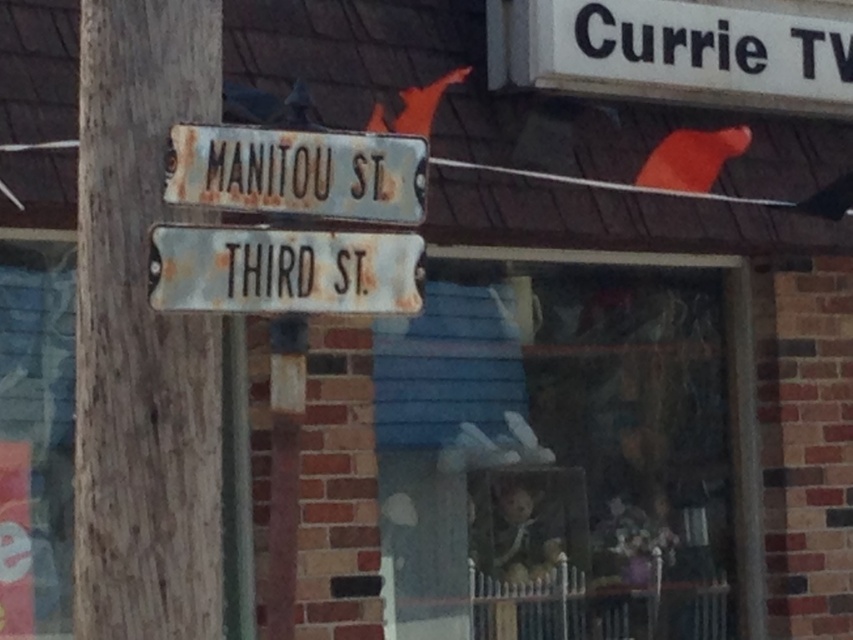
You are a painter who needs to paint both the rusty wood telegraph pole at left and the rusty metal street sign at center. Which object will require more ladder height to reach its top?

The rusty wood telegraph pole at left is much taller as rusty metal street sign at center, so the painter will need a taller ladder to reach the top of the rusty wood telegraph pole at left.

You are standing in front of a street signpost and want to take a photo of both the blue wooden fence at center and the rusty metal pole at left. Which object should you focus on first if you want to include both in your frame without moving the camera?

The blue wooden fence at center is larger in size than the rusty metal pole at left, so you should focus on the blue wooden fence at center first to ensure it fits within the frame while still capturing the rusty metal pole at left.

You are a painter who needs to paint both the blue wooden fence at center and the rusty metal pole at left. Based on the scene, which object requires a taller ladder to reach its top?

The blue wooden fence at center is taller than the rusty metal pole at left, so you will need a taller ladder to reach the top of the blue wooden fence at center.